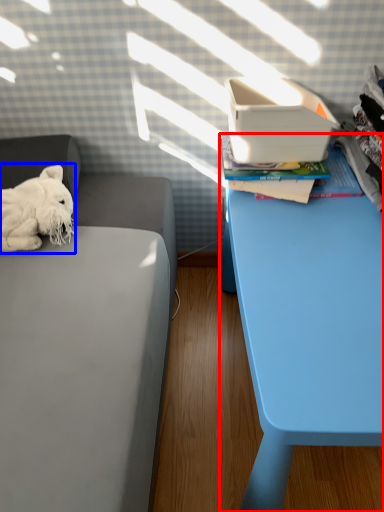
Question: Which of the following is the farthest to the observer, table (highlighted by a red box) or dog (highlighted by a blue box)?

Choices:
 (A) table
 (B) dog

Answer: (B)